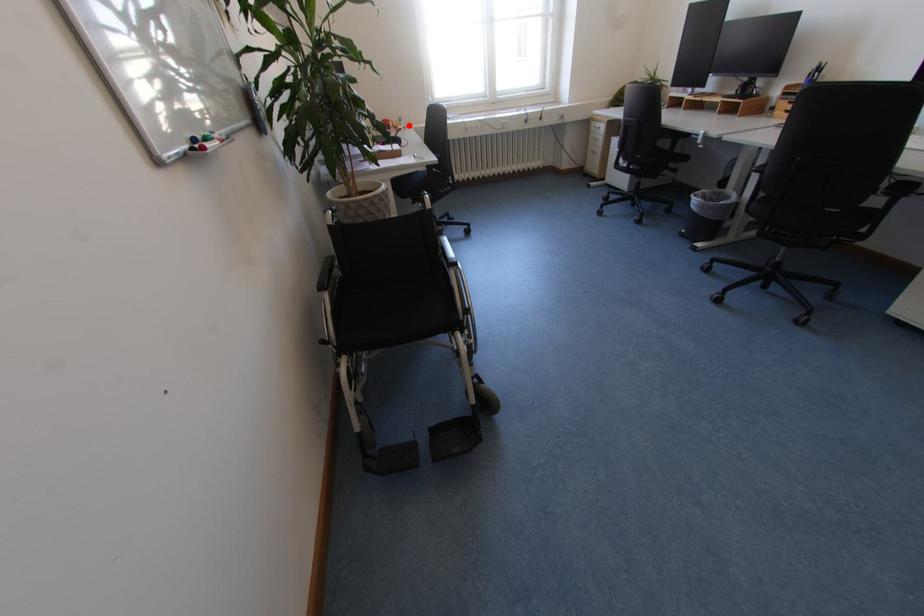
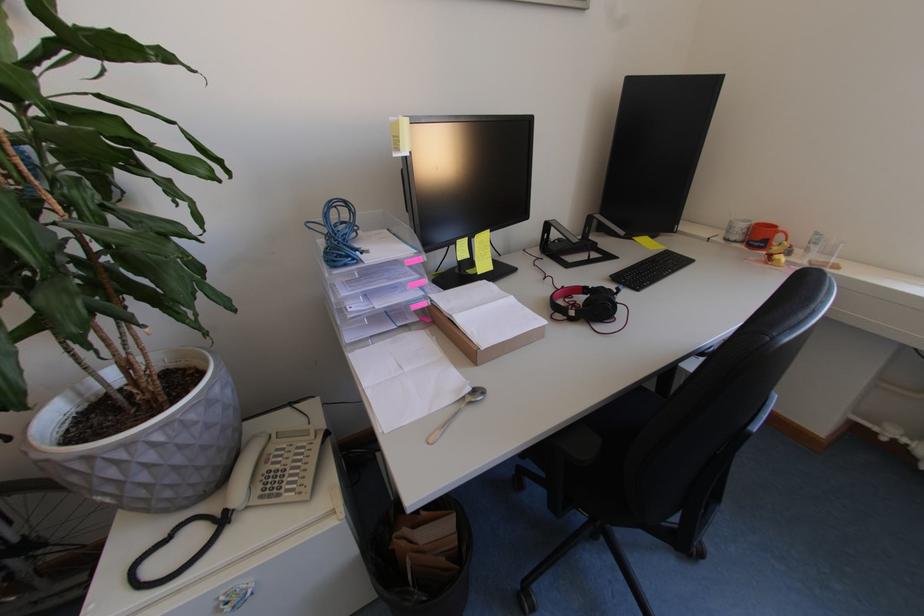
The point at the highlighted location is marked in the first image. Where is the corresponding point in the second image?

(816, 253)